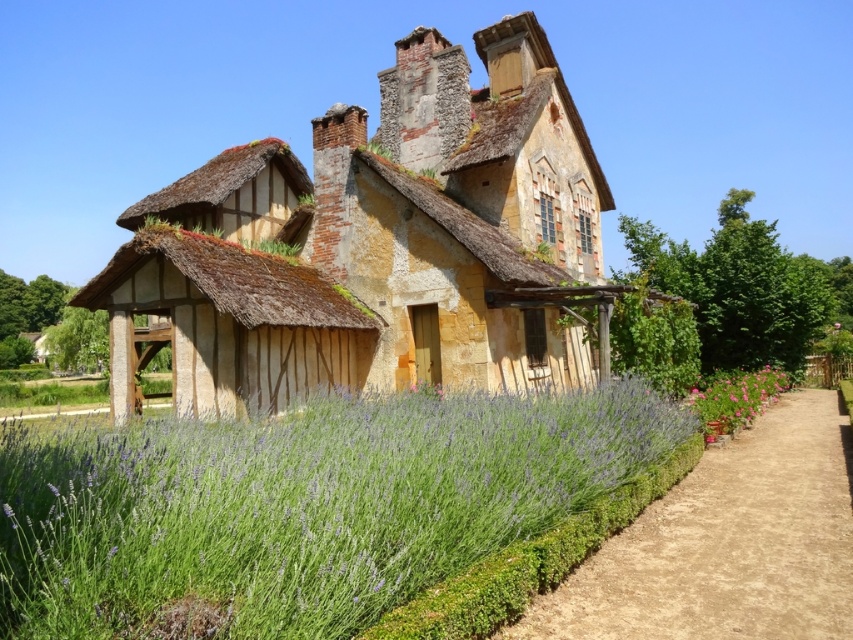
You are standing in the garden in front of the rustic building. If you walk directly towards the yellowish stone cottage at center, which direction should you head?

The yellowish stone cottage at center is located at point (379, 244), so you should head towards the center of the image to reach it.